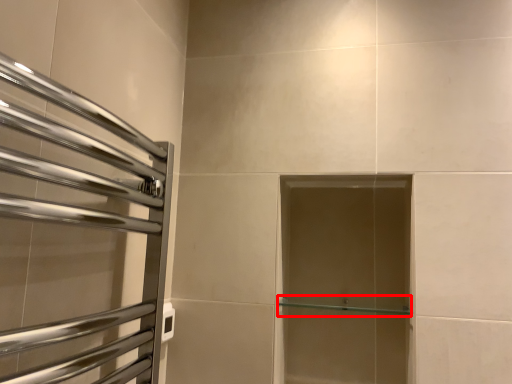
Question: From the image's perspective, where is shelf (annotated by the red box) located relative to screen door?

Choices:
 (A) above
 (B) below

Answer: (B)